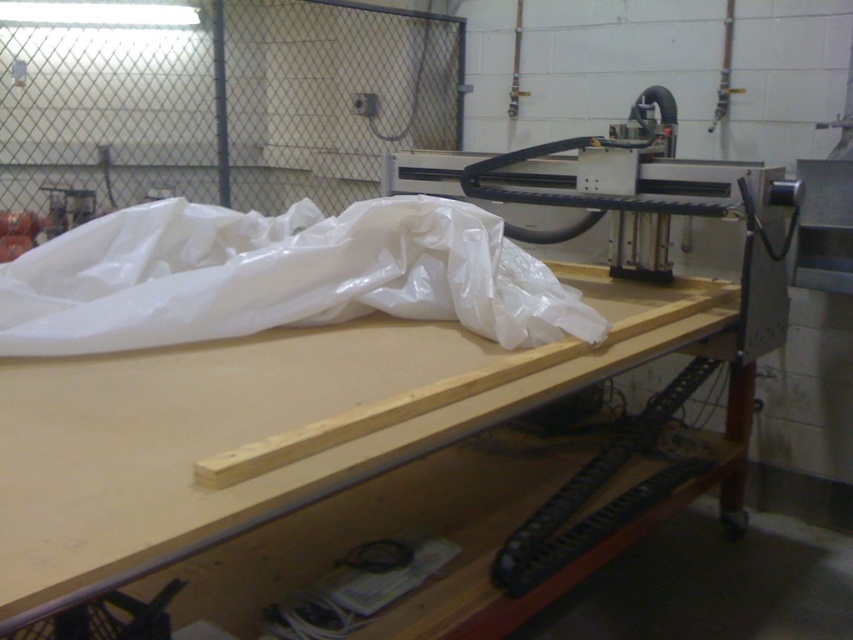
Does white plastic bag at center have a smaller size compared to black plastic track at lower center?

Indeed, white plastic bag at center has a smaller size compared to black plastic track at lower center.

Which is more to the left, white plastic bag at center or black plastic track at lower center?

white plastic bag at center

Who is more forward, (1,305) or (595,529)?

Point (1,305)

Find the location of `white plastic bag at center`. white plastic bag at center is located at coordinates (279, 276).

Is the position of light brown wood at center less distant than that of black plastic track at lower center?

Yes, it is in front of black plastic track at lower center.

Can you confirm if light brown wood at center is positioned to the left of black plastic track at lower center?

Yes, light brown wood at center is to the left of black plastic track at lower center.

The image size is (853, 640). Find the location of `light brown wood at center`. light brown wood at center is located at coordinates (265, 428).

What do you see at coordinates (265, 428) in the screenshot? I see `light brown wood at center` at bounding box center [265, 428].

At what (x,y) coordinates should I click in order to perform the action: click on light brown wood at center. Please return your answer as a coordinate pair (x, y). Looking at the image, I should click on (265, 428).